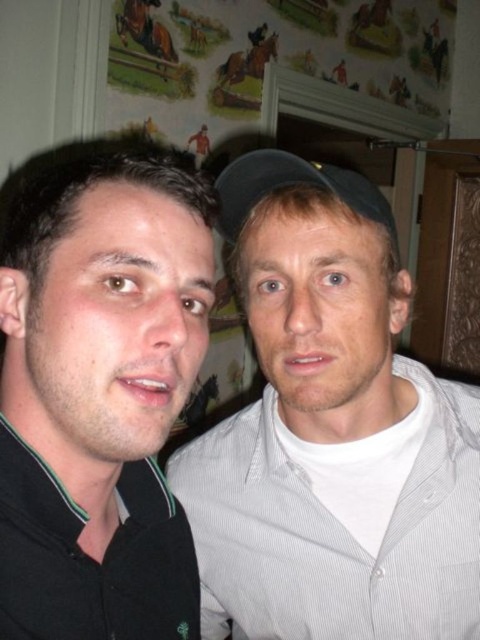
You are trying to decide which item to grab first from the scene. Since both the gray striped shirt at center and the black fabric baseball cap at center are in your reach, which one can you pick up without needing to adjust your grip because it is bigger?

The gray striped shirt at center is larger in size than the black fabric baseball cap at center, so you can pick up the gray striped shirt at center first without needing to adjust your grip due to its larger size.

You are trying to decide which item to take with you for a quick trip. You can only choose between the black matte shirt at left and the black fabric baseball cap at center. Based on their sizes, which one is smaller?

The black matte shirt at left is smaller than the black fabric baseball cap at center because its width is less than the cap.

You are a photographer setting up for a group photo. You need to ensure there is enough space between the gray striped shirt at center and the black matte shirt at left for a camera to fit. The camera you are using is 15 centimeters wide. Based on the scene, can the camera fit between them?

The gray striped shirt at center and the black matte shirt at left are 16.73 centimeters apart, which is wider than the camera width of 15 centimeters. Therefore, the camera can fit between them.